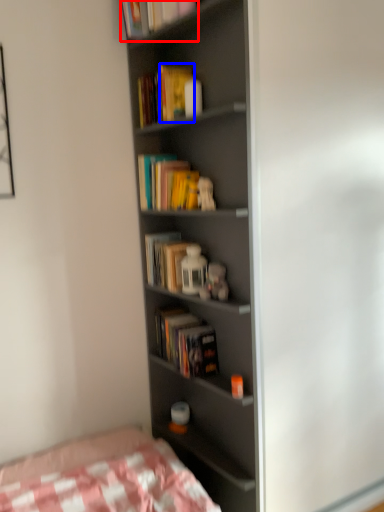
Question: Among these objects, which one is farthest to the camera, book (highlighted by a red box) or paperback book (highlighted by a blue box)?

Choices:
 (A) book
 (B) paperback book

Answer: (A)